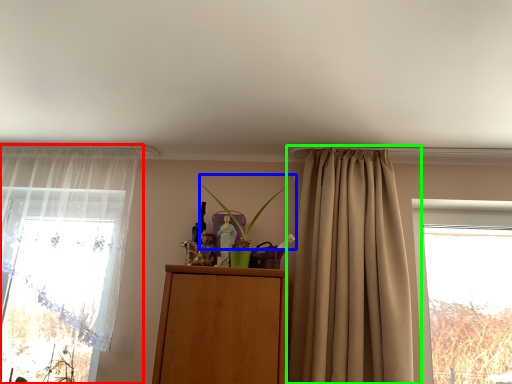
Question: Which object is the closest to the curtain (highlighted by a red box)? Choose among these: plant (highlighted by a blue box) or curtain (highlighted by a green box).

Choices:
 (A) plant
 (B) curtain

Answer: (A)